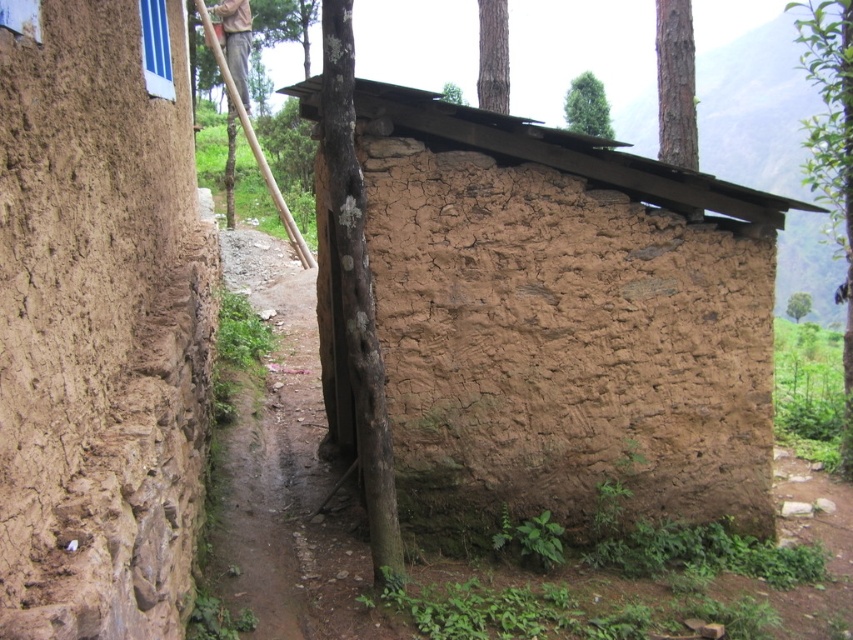
You are standing at the entrance of the brown mud hut at center and want to look over the dusty dirt path at center. Can you see over the path from where you are standing?

The brown mud hut at center is not as tall as the dusty dirt path at center, so you cannot see over the path from where you are standing.

You are standing on the dusty dirt path at center and want to enter the brown mud hut at center. Which direction should you move to reach the entrance?

The dusty dirt path at center is behind the brown mud hut at center, so you should move forward towards the brown mud hut at center to reach its entrance.